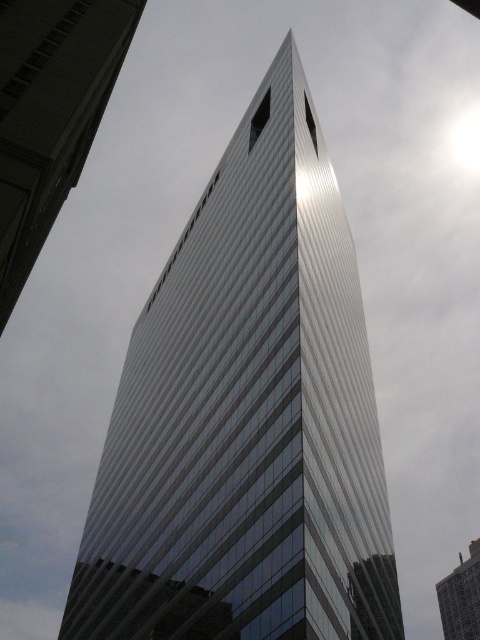
Is the position of sleek silver skyscraper at center more distant than that of white glass tower at center?

No, it is not.

Does sleek silver skyscraper at center have a greater height compared to white glass tower at center?

No.

The width and height of the screenshot is (480, 640). Find the location of `sleek silver skyscraper at center`. sleek silver skyscraper at center is located at coordinates (50, 115).

Where is `sleek silver skyscraper at center`? sleek silver skyscraper at center is located at coordinates (50, 115).

Is white glass building at center further to the viewer compared to sleek silver skyscraper at center?

Yes.

Can you confirm if white glass building at center is thinner than sleek silver skyscraper at center?

Incorrect, white glass building at center's width is not less than sleek silver skyscraper at center's.

Locate an element on the screen. The height and width of the screenshot is (640, 480). white glass building at center is located at coordinates (247, 417).

Image resolution: width=480 pixels, height=640 pixels. What do you see at coordinates (247, 417) in the screenshot?
I see `white glass building at center` at bounding box center [247, 417].

Who is lower down, white glass building at center or white glass tower at center?

white glass tower at center is below.

Between point (159, 358) and point (471, 600), which one is positioned behind?

The point (471, 600) is more distant.

This screenshot has width=480, height=640. Find the location of `white glass building at center`. white glass building at center is located at coordinates (247, 417).